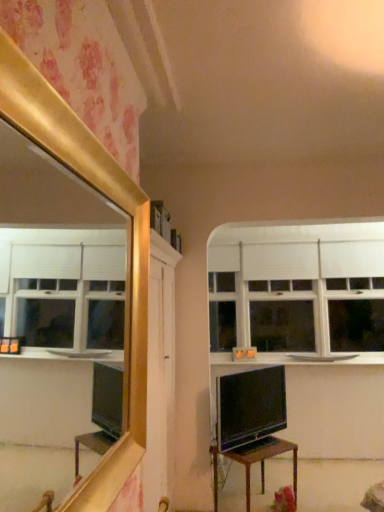
Question: Considering the relative positions of matte black tv at center and white glossy counter top at upper right in the image provided, is matte black tv at center to the left or to the right of white glossy counter top at upper right?

Choices:
 (A) right
 (B) left

Answer: (B)

Question: Considering the positions of point (271, 384) and point (301, 353), is point (271, 384) closer or farther from the camera than point (301, 353)?

Choices:
 (A) closer
 (B) farther

Answer: (A)

Question: Which is farther from the white glossy counter top at upper right?

Choices:
 (A) wooden table at center
 (B) matte black tv at center
 (C) white matte window at upper center

Answer: (A)

Question: Which is nearer to the wooden table at center?

Choices:
 (A) white matte window at upper center
 (B) white glossy counter top at upper right
 (C) matte black tv at center

Answer: (C)